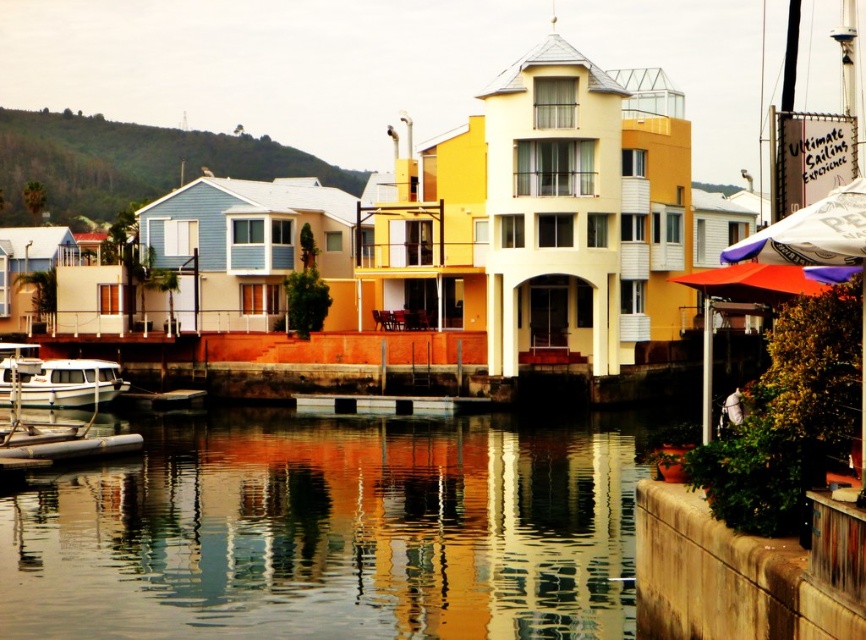
Which is below, white fabric umbrella at upper right or white matte boat at lower left?

white matte boat at lower left

Does point (777, 262) come closer to viewer compared to point (14, 387)?

Yes.

The width and height of the screenshot is (866, 640). I want to click on white fabric umbrella at upper right, so click(x=811, y=234).

Which is below, reflective glass water at lower center or white fabric umbrella at upper right?

reflective glass water at lower center is below.

Where is `reflective glass water at lower center`? This screenshot has width=866, height=640. reflective glass water at lower center is located at coordinates (334, 531).

Between point (563, 516) and point (829, 211), which one is positioned in front?

Point (829, 211) is more forward.

Identify the location of reflective glass water at lower center. Image resolution: width=866 pixels, height=640 pixels. (334, 531).

The height and width of the screenshot is (640, 866). What do you see at coordinates (131, 163) in the screenshot? I see `green grassy hillside at upper left` at bounding box center [131, 163].

Which is above, green grassy hillside at upper left or white fabric umbrella at upper right?

green grassy hillside at upper left

The height and width of the screenshot is (640, 866). What do you see at coordinates (131, 163) in the screenshot?
I see `green grassy hillside at upper left` at bounding box center [131, 163].

I want to click on green grassy hillside at upper left, so click(x=131, y=163).